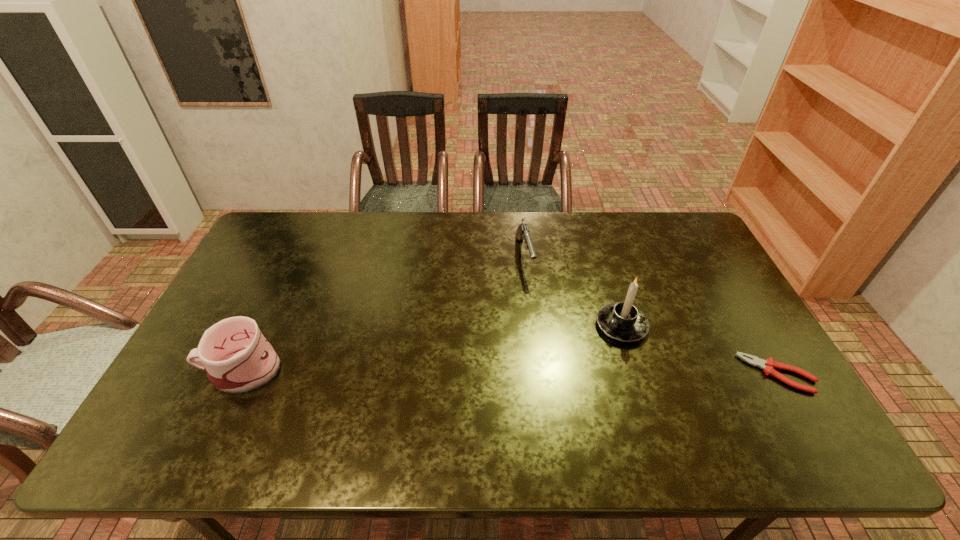
Locate an element on the screen. The image size is (960, 540). object that can be found as the third closest to the third tallest object is located at coordinates (237, 357).